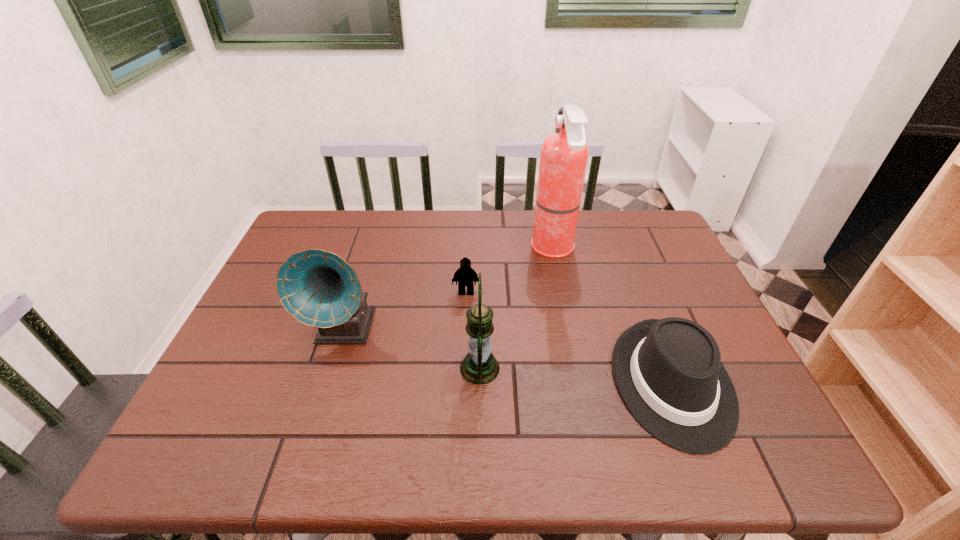
Locate an element on the screen. vacant space located 0.270m on the side where the lantern emits light is located at coordinates (615, 368).

Find the location of a particular element. blank space located on the face of the Lego is located at coordinates (462, 424).

You are a GUI agent. You are given a task and a screenshot of the screen. Output one action in this format:
    pyautogui.click(x=<x>, y=<y>)
    Task: Click on the object that is positioned at the far edge
    This screenshot has width=960, height=540.
    Given the screenshot: What is the action you would take?
    pyautogui.click(x=564, y=155)

The image size is (960, 540). Identify the location of object that is at the near edge. (668, 372).

Locate an element on the screen. This screenshot has height=540, width=960. object at the right edge is located at coordinates (668, 372).

This screenshot has width=960, height=540. In order to click on object present at the near right corner in this screenshot , I will do `click(668, 372)`.

Where is `free spot at the far edge of the desktop`? The height and width of the screenshot is (540, 960). free spot at the far edge of the desktop is located at coordinates (414, 235).

The height and width of the screenshot is (540, 960). Find the location of `free space at the near edge of the desktop`. free space at the near edge of the desktop is located at coordinates (267, 440).

Locate an element on the screen. vacant space at the left edge is located at coordinates (270, 344).

In the image, there is a desktop. Where is `vacant area at the right edge`? This screenshot has width=960, height=540. vacant area at the right edge is located at coordinates (680, 260).